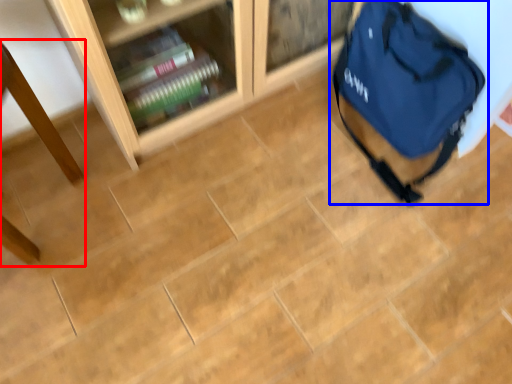
Question: Which point is closer to the camera, table (highlighted by a red box) or backpack (highlighted by a blue box)?

Choices:
 (A) table
 (B) backpack

Answer: (A)